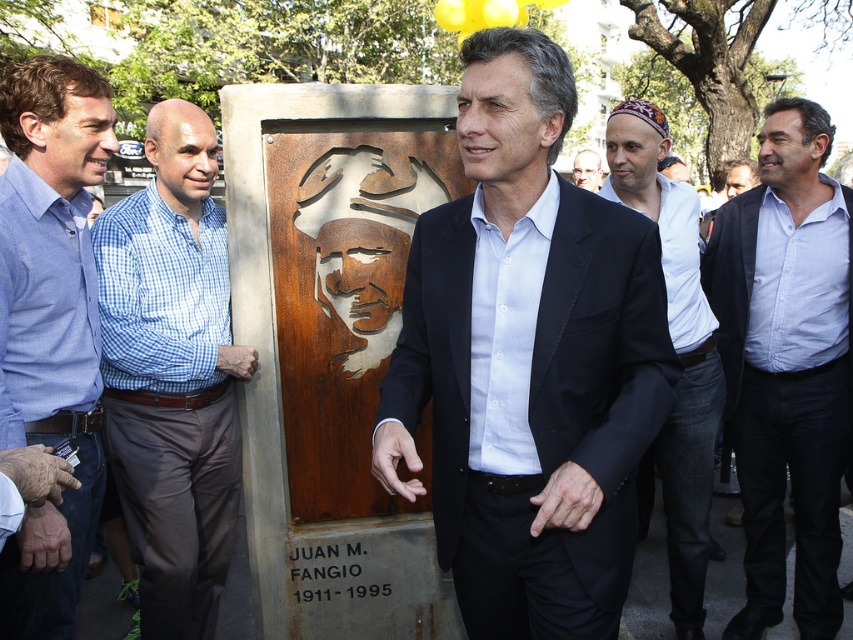
Question: Can you confirm if blue checkered shirt at center is positioned below light brown leather belt at center?

Choices:
 (A) yes
 (B) no

Answer: (A)

Question: Which point appears closest to the camera in this image?

Choices:
 (A) (741, 362)
 (B) (582, 188)
 (C) (593, 572)
 (D) (686, 376)

Answer: (C)

Question: Which point is farther from the camera taking this photo?

Choices:
 (A) (801, 196)
 (B) (671, 173)
 (C) (6, 554)

Answer: (B)

Question: In this image, where is matte brown statue at center located relative to light brown leather belt at center?

Choices:
 (A) below
 (B) above

Answer: (A)

Question: Which is farther from the matte brown statue at center?

Choices:
 (A) blue checkered shirt at center
 (B) rustic metal plaque at center
 (C) white cotton shirt at center

Answer: (B)

Question: Does rustic metal plaque at center appear on the left side of blue shirt at center?

Choices:
 (A) no
 (B) yes

Answer: (B)